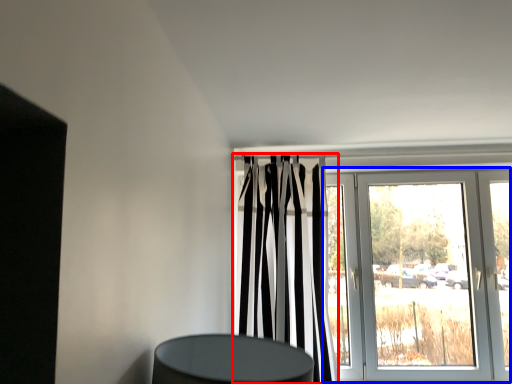
Question: Which object is further to the camera taking this photo, curtain (highlighted by a red box) or door (highlighted by a blue box)?

Choices:
 (A) curtain
 (B) door

Answer: (B)